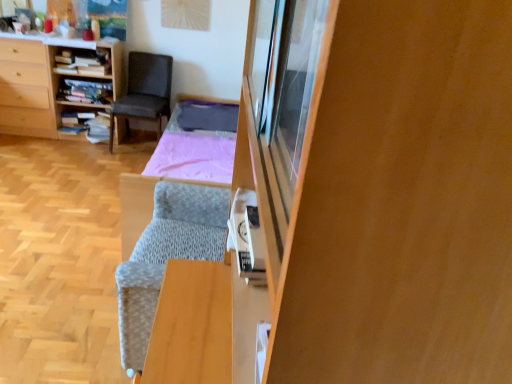
Where is `free point in front of dark gray fabric chair at upper left`? The height and width of the screenshot is (384, 512). free point in front of dark gray fabric chair at upper left is located at coordinates (108, 157).